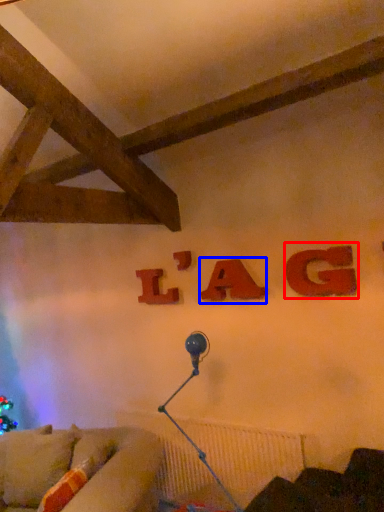
Question: Among these objects, which one is nearest to the camera, alphabet (highlighted by a red box) or alphabet (highlighted by a blue box)?

Choices:
 (A) alphabet
 (B) alphabet

Answer: (A)